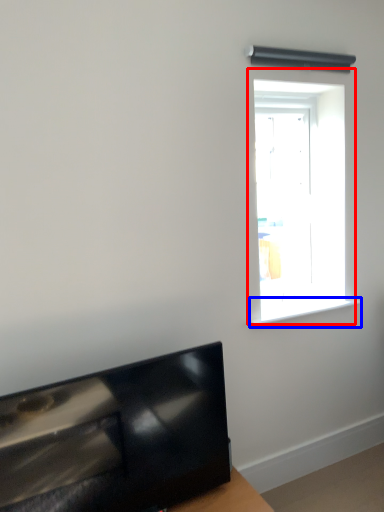
Question: Which object appears farthest to the camera in this image, window (highlighted by a red box) or window sill (highlighted by a blue box)?

Choices:
 (A) window
 (B) window sill

Answer: (B)